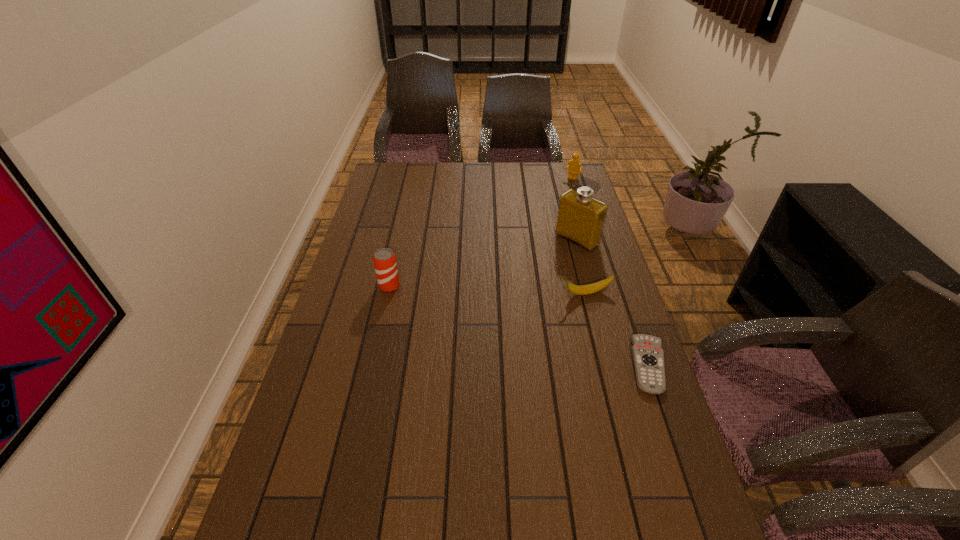
Find the location of a particular element. Image resolution: width=960 pixels, height=540 pixels. beer can is located at coordinates (384, 259).

Where is `the shortest object`? The image size is (960, 540). the shortest object is located at coordinates click(648, 357).

The height and width of the screenshot is (540, 960). Find the location of `the nearest object`. the nearest object is located at coordinates (648, 357).

The width and height of the screenshot is (960, 540). In order to click on banana in this screenshot , I will do click(x=592, y=288).

Identify the location of the tallest object. tap(581, 218).

The width and height of the screenshot is (960, 540). I want to click on perfume, so click(x=581, y=218).

Locate an element on the screen. the farthest object is located at coordinates (575, 167).

Where is `blank space located on the back of the beer can`? This screenshot has height=540, width=960. blank space located on the back of the beer can is located at coordinates (398, 243).

I want to click on vacant area located on the front of the nearest object, so click(x=707, y=530).

This screenshot has height=540, width=960. In order to click on vacant space located at the stem of the second shortest object in this screenshot , I will do coord(522,301).